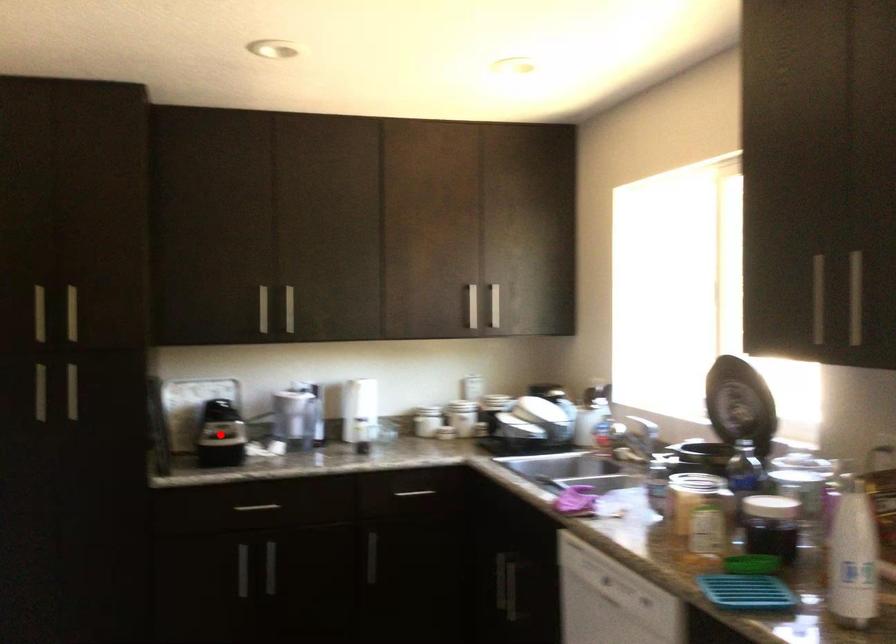
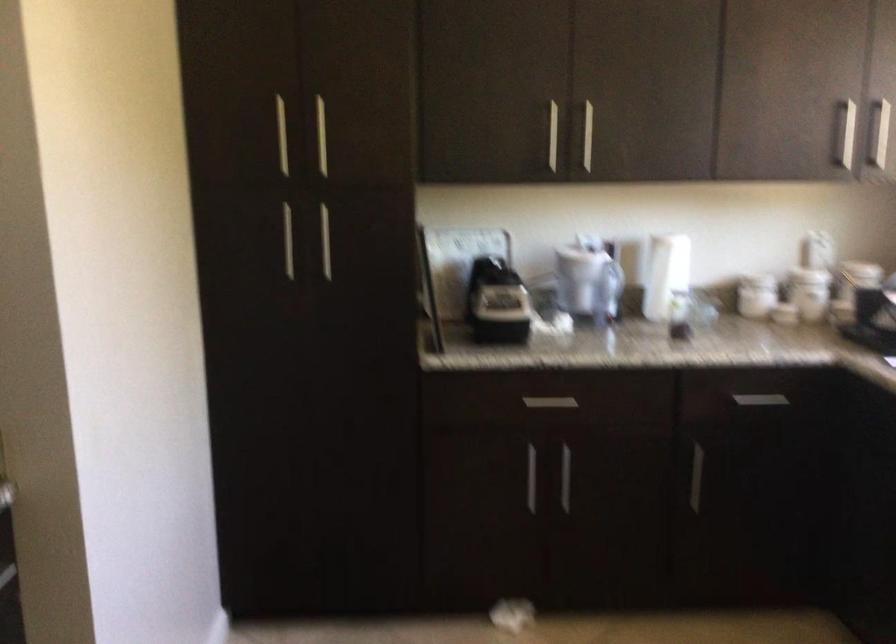
Question: I am providing you with two images of the same scene from different viewpoints. Given a red point in image1, look at the same physical point in image2. Is it:

Choices:
 (A) Closer to the viewpoint
 (B) Farther from the viewpoint

Answer: (A)